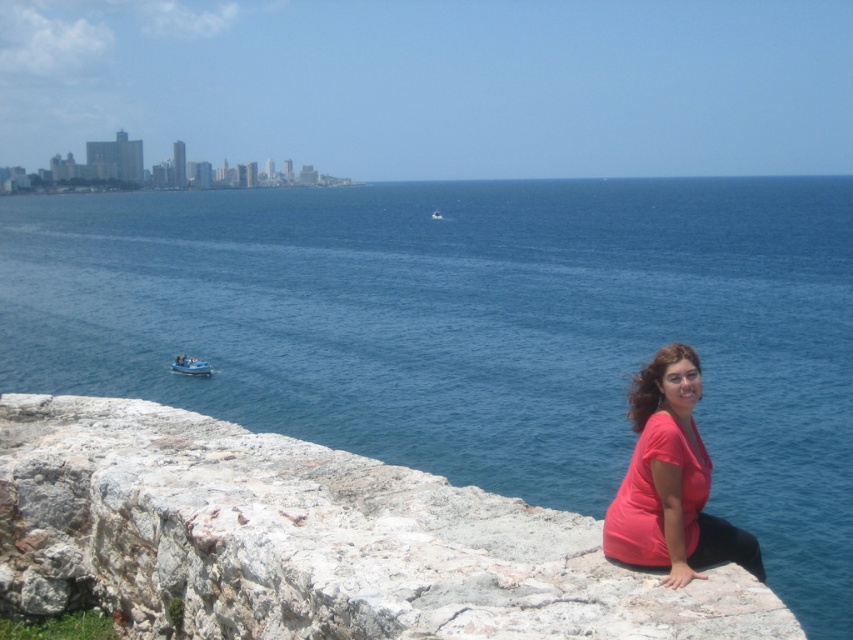
Question: Which object is positioned farthest from the smooth blue boat at left?

Choices:
 (A) blue water at center
 (B) matte pink shirt at lower right
 (C) blue plastic boat at center

Answer: (C)

Question: Which is farther from the smooth blue boat at left?

Choices:
 (A) blue water at center
 (B) matte pink shirt at lower right

Answer: (A)

Question: Does blue water at center appear on the right side of matte pink shirt at lower right?

Choices:
 (A) no
 (B) yes

Answer: (B)

Question: Observing the image, what is the correct spatial positioning of blue water at center in reference to smooth blue boat at left?

Choices:
 (A) above
 (B) below

Answer: (A)

Question: Does matte pink shirt at lower right appear over smooth blue boat at left?

Choices:
 (A) yes
 (B) no

Answer: (A)

Question: Which point is farther from the camera taking this photo?

Choices:
 (A) (440, 218)
 (B) (83, 296)

Answer: (A)